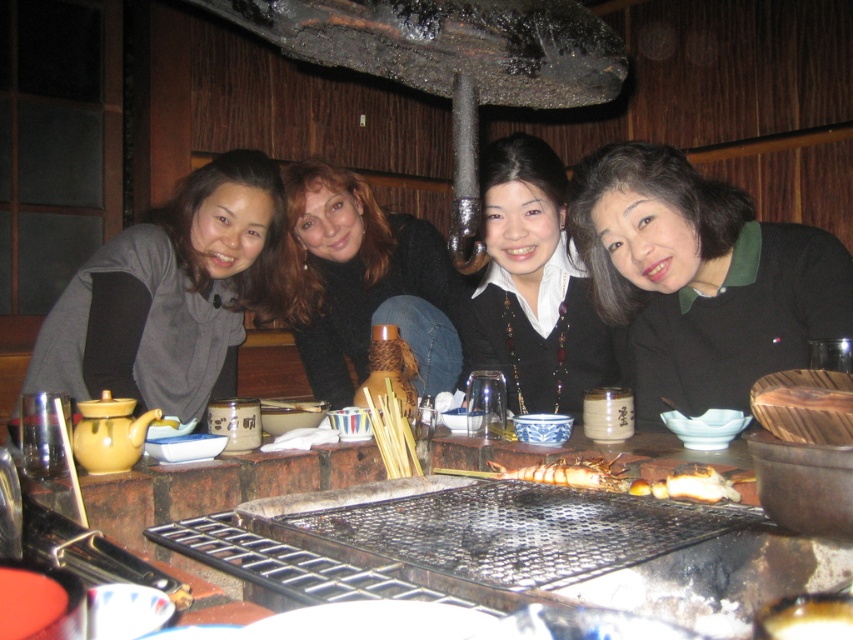
Question: Which point is closer to the camera?

Choices:
 (A) black matte necklace at center
 (B) matte gray sweater at center
 (C) metal grill at center
 (D) smooth black sweater at center

Answer: (C)

Question: Does smooth black sweater at center have a greater width compared to black matte necklace at center?

Choices:
 (A) yes
 (B) no

Answer: (A)

Question: Among these points, which one is nearest to the camera?

Choices:
 (A) (299, 353)
 (B) (822, 566)

Answer: (B)

Question: Does metal grill at center have a greater width compared to smooth black sweater at center?

Choices:
 (A) no
 (B) yes

Answer: (B)

Question: Considering the real-world distances, which object is closest to the black matte necklace at center?

Choices:
 (A) black sweater at center
 (B) matte gray sweater at center

Answer: (A)

Question: Is metal grill at center closer to the viewer compared to matte gray sweater at center?

Choices:
 (A) yes
 (B) no

Answer: (A)